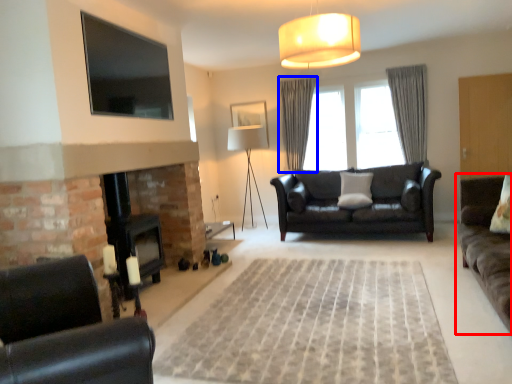
Question: Which object is closer to the camera taking this photo, studio couch (highlighted by a red box) or curtain (highlighted by a blue box)?

Choices:
 (A) studio couch
 (B) curtain

Answer: (A)